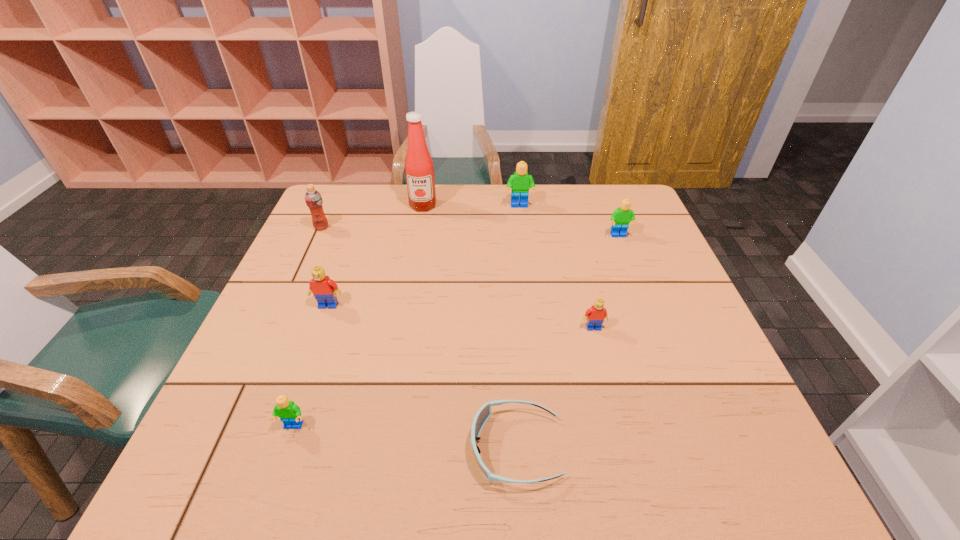
This screenshot has width=960, height=540. I want to click on condiment, so click(419, 168).

Locate an element on the screen. red condiment is located at coordinates (419, 168).

Identify the location of the tallest Lego. This screenshot has width=960, height=540. (520, 182).

Locate an element on the screen. This screenshot has height=540, width=960. the second green Lego from left to right is located at coordinates (520, 182).

The height and width of the screenshot is (540, 960). What are the coordinates of `orange juice` in the screenshot? It's located at (313, 199).

Locate an element on the screen. the third farthest object is located at coordinates tap(313, 199).

The width and height of the screenshot is (960, 540). In order to click on the fourth nearest object in this screenshot , I will do `click(324, 289)`.

Find the location of a particular element. the farther red Lego is located at coordinates (324, 289).

Where is `the fourth farthest object`? The width and height of the screenshot is (960, 540). the fourth farthest object is located at coordinates (620, 218).

You are a GUI agent. You are given a task and a screenshot of the screen. Output one action in this format:
    pyautogui.click(x=<x>, y=<y>)
    Task: Click on the rightmost object
    The height and width of the screenshot is (540, 960).
    Given the screenshot: What is the action you would take?
    pyautogui.click(x=620, y=218)